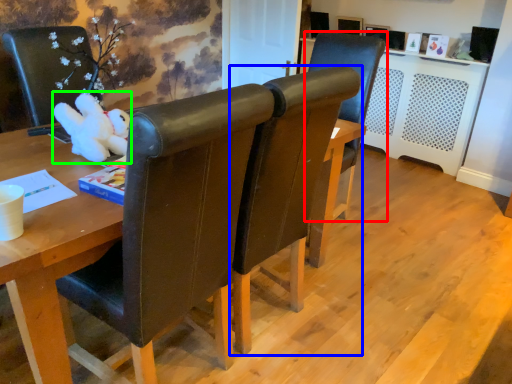
Question: Based on their relative distances, which object is farther from chair (highlighted by a red box)? Choose from chair (highlighted by a blue box) and toy (highlighted by a green box).

Choices:
 (A) chair
 (B) toy

Answer: (B)